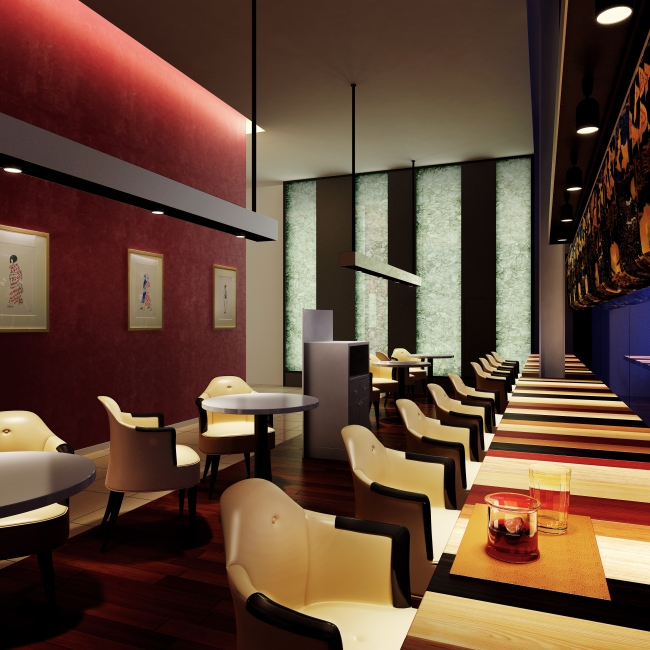
You are a GUI agent. You are given a task and a screenshot of the screen. Output one action in this format:
    pyautogui.click(x=<x>, y=<y>)
    Task: Click on the red wall
    The width and height of the screenshot is (650, 650).
    Given the screenshot: What is the action you would take?
    pyautogui.click(x=77, y=250)